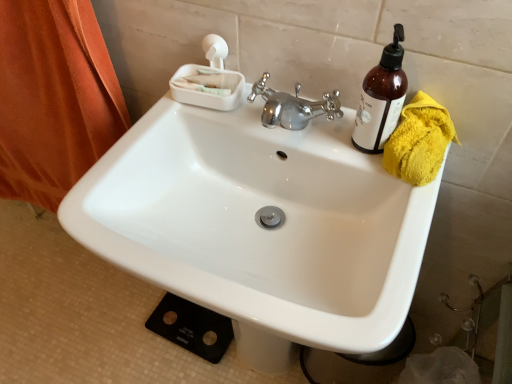
In order to click on vacant space that is in between white glossy sink at center and orange fabric at left in this screenshot , I will do `click(103, 299)`.